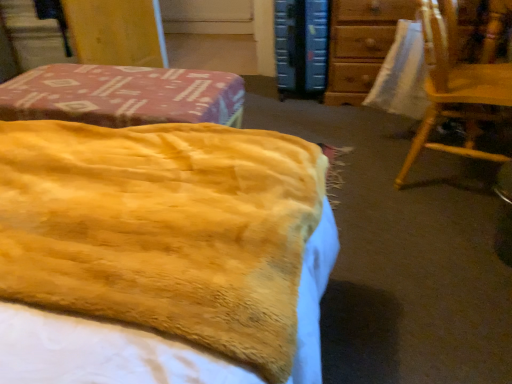
You are a GUI agent. You are given a task and a screenshot of the screen. Output one action in this format:
    pyautogui.click(x=<x>, y=<y>)
    Task: Click on the vacant space in wooden chair at right (from a real-world perspective)
    
    Given the screenshot: What is the action you would take?
    pyautogui.click(x=432, y=173)